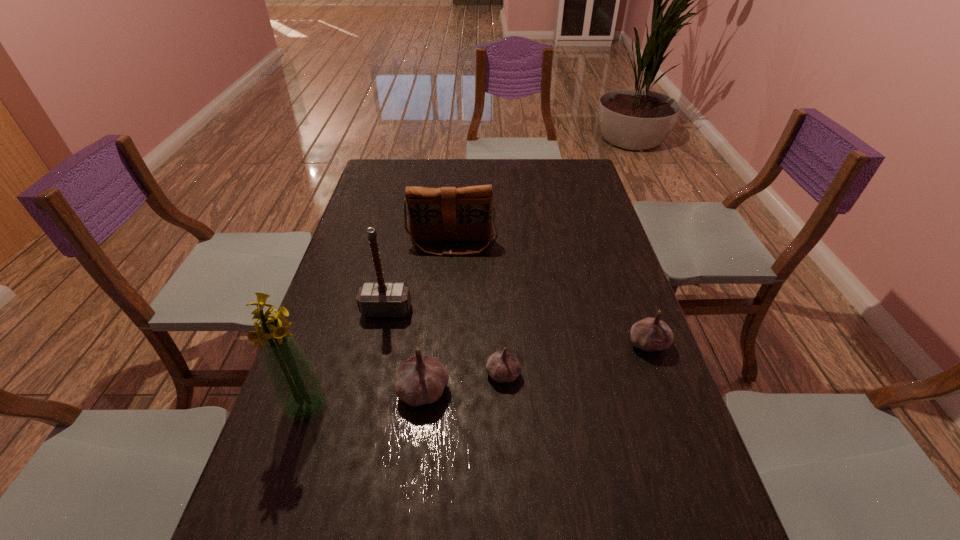
If equal spacing is desired by inserting an extra garlic among them, please point out a free spot for this new garlic. Please provide its 2D coordinates. Your answer should be formatted as a tuple, i.e. [(x, y)], where the tuple contains the x and y coordinates of a point satisfying the conditions above.

[(578, 358)]